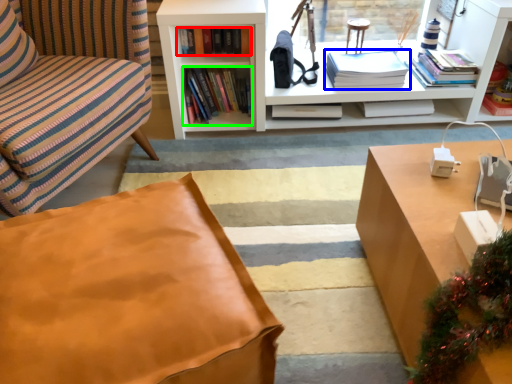
Question: Estimate the real-world distances between objects in this image. Which object is farther from book (highlighted by a red box), book (highlighted by a blue box) or book (highlighted by a green box)?

Choices:
 (A) book
 (B) book

Answer: (A)